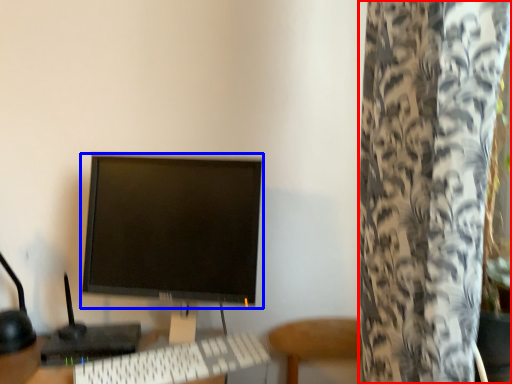
Question: Which object appears closest to the camera in this image, curtain (highlighted by a red box) or computer monitor (highlighted by a blue box)?

Choices:
 (A) curtain
 (B) computer monitor

Answer: (A)